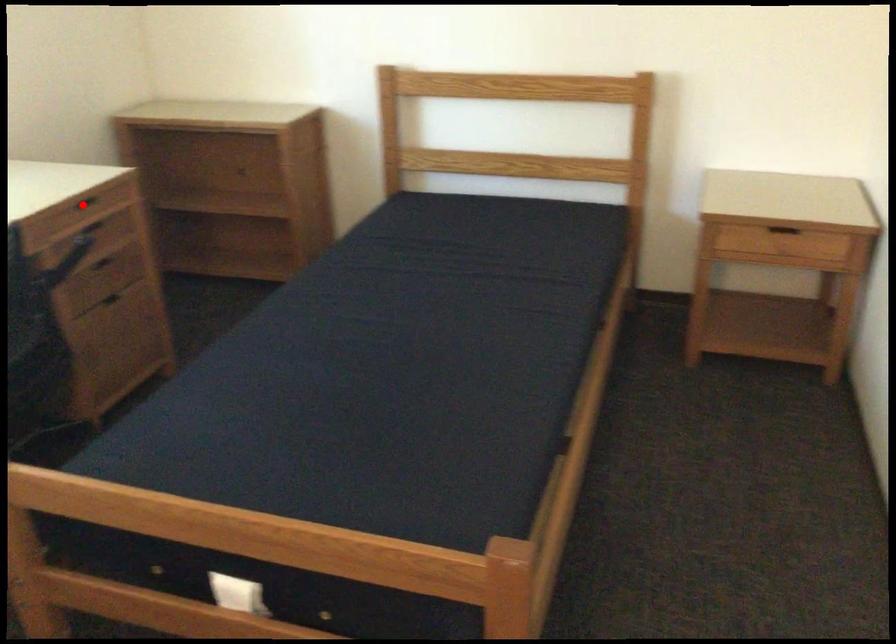
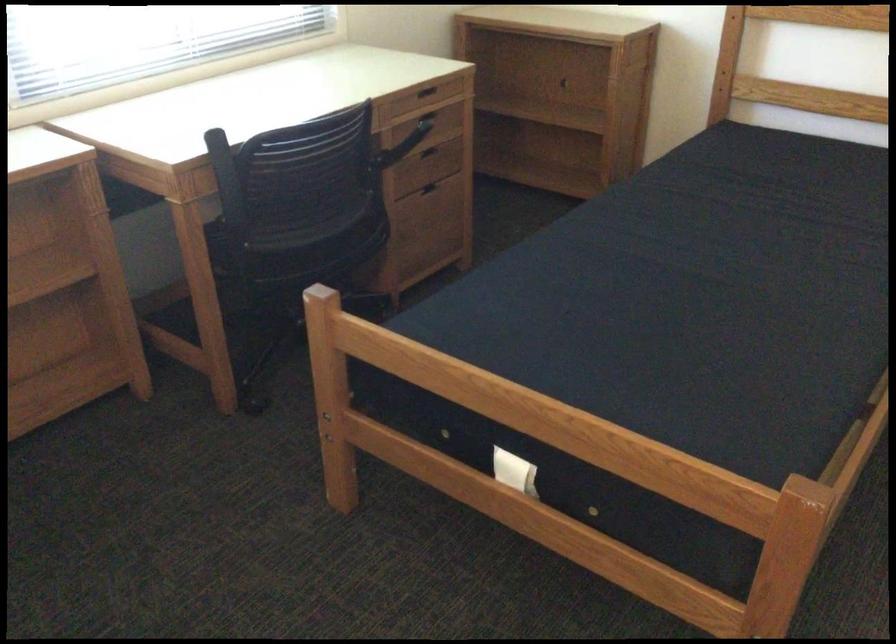
The point at the highlighted location is marked in the first image. Where is the corresponding point in the second image?

(424, 91)